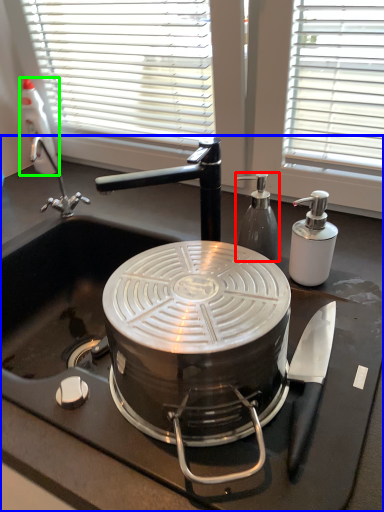
Question: Considering the real-world distances, which object is farthest from kitchen appliance (highlighted by a red box)? sink (highlighted by a blue box) or bottle (highlighted by a green box)?

Choices:
 (A) sink
 (B) bottle

Answer: (B)